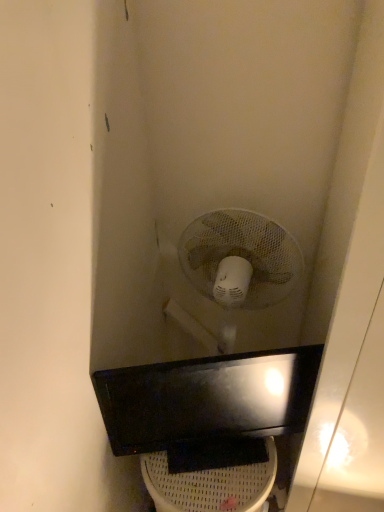
Describe the element at coordinates (210, 485) in the screenshot. I see `white plastic toilet bowl at lower center` at that location.

This screenshot has width=384, height=512. In order to click on white plastic toilet bowl at lower center in this screenshot , I will do `click(210, 485)`.

This screenshot has width=384, height=512. In order to click on black glossy sink at center in this screenshot , I will do (205, 398).

What do you see at coordinates (205, 398) in the screenshot?
I see `black glossy sink at center` at bounding box center [205, 398].

Measure the distance between point (252, 404) and camera.

A distance of 1.15 meters exists between point (252, 404) and camera.

Find the location of a particular element. The image size is (384, 512). white plastic toilet bowl at lower center is located at coordinates (210, 485).

In the scene shown: Does white plastic toilet bowl at lower center appear on the left side of black glossy sink at center?

Yes.

Which object is further away from the camera taking this photo, white plastic toilet bowl at lower center or black glossy sink at center?

white plastic toilet bowl at lower center is further from the camera.

Does point (162, 469) come in front of point (177, 421)?

No, it is not.

From the image's perspective, between white plastic toilet bowl at lower center and black glossy sink at center, which one is located above?

black glossy sink at center is shown above in the image.

Consider the image. From a real-world perspective, which object stands above the other?

In real-world perspective, black glossy sink at center is above.

Considering the sizes of objects white plastic toilet bowl at lower center and black glossy sink at center in the image provided, who is wider, white plastic toilet bowl at lower center or black glossy sink at center?

With larger width is white plastic toilet bowl at lower center.

From their relative heights in the image, would you say white plastic toilet bowl at lower center is taller or shorter than black glossy sink at center?

Considering their sizes, white plastic toilet bowl at lower center has more height than black glossy sink at center.

In terms of size, does white plastic toilet bowl at lower center appear bigger or smaller than black glossy sink at center?

Considering their sizes, white plastic toilet bowl at lower center takes up more space than black glossy sink at center.

Based on the photo, is white plastic toilet bowl at lower center located outside black glossy sink at center?

That's correct, white plastic toilet bowl at lower center is outside of black glossy sink at center.

In the scene shown: Does white plastic toilet bowl at lower center touch black glossy sink at center?

They are not placed beside each other.

Is white plastic toilet bowl at lower center facing away from black glossy sink at center?

That's not correct — white plastic toilet bowl at lower center is not looking away from black glossy sink at center.

How much distance is there between white plastic toilet bowl at lower center and black glossy sink at center?

white plastic toilet bowl at lower center and black glossy sink at center are 18.17 centimeters apart from each other.

The width and height of the screenshot is (384, 512). I want to click on toilet bowl lying below the black glossy sink at center (from the image's perspective), so click(210, 485).

Would you say black glossy sink at center is to the left or to the right of white plastic toilet bowl at lower center in the picture?

In the image, black glossy sink at center appears on the right side of white plastic toilet bowl at lower center.

Considering their positions, is black glossy sink at center located in front of or behind white plastic toilet bowl at lower center?

black glossy sink at center is in front of white plastic toilet bowl at lower center.

Is point (157, 384) closer to viewer compared to point (164, 490)?

Yes, it is.

From the image's perspective, is black glossy sink at center positioned above or below white plastic toilet bowl at lower center?

black glossy sink at center is above white plastic toilet bowl at lower center.

In the scene shown: From a real-world perspective, is black glossy sink at center located beneath white plastic toilet bowl at lower center?

No, from a real-world perspective, black glossy sink at center is not beneath white plastic toilet bowl at lower center.

In terms of width, does black glossy sink at center look wider or thinner when compared to white plastic toilet bowl at lower center?

Clearly, black glossy sink at center has less width compared to white plastic toilet bowl at lower center.

Who is shorter, black glossy sink at center or white plastic toilet bowl at lower center?

black glossy sink at center.

Considering the relative sizes of black glossy sink at center and white plastic toilet bowl at lower center in the image provided, is black glossy sink at center bigger than white plastic toilet bowl at lower center?

Actually, black glossy sink at center might be smaller than white plastic toilet bowl at lower center.

Is black glossy sink at center not inside white plastic toilet bowl at lower center?

black glossy sink at center is positioned outside white plastic toilet bowl at lower center.

Is there a large distance between black glossy sink at center and white plastic toilet bowl at lower center?

That's not correct — black glossy sink at center is a little close to white plastic toilet bowl at lower center.

Is black glossy sink at center positioned with its back to white plastic toilet bowl at lower center?

No, white plastic toilet bowl at lower center is not at the back of black glossy sink at center.

What's the angular difference between black glossy sink at center and white plastic toilet bowl at lower center's facing directions?

They differ by 18.6 degrees in their facing directions.

The image size is (384, 512). What are the coordinates of `sink above the white plastic toilet bowl at lower center (from the image's perspective)` in the screenshot? It's located at (205, 398).

At what (x,y) coordinates should I click in order to perform the action: click on sink above the white plastic toilet bowl at lower center (from the image's perspective). Please return your answer as a coordinate pair (x, y). This screenshot has height=512, width=384. Looking at the image, I should click on (205, 398).

Identify the location of sink above the white plastic toilet bowl at lower center (from a real-world perspective). The width and height of the screenshot is (384, 512). (205, 398).